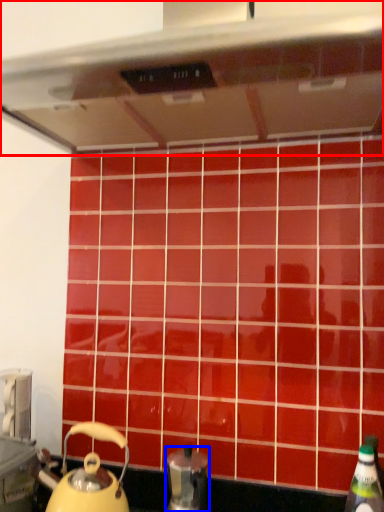
Question: Which point is further to the camera, exhaust hood (highlighted by a red box) or kitchen appliance (highlighted by a blue box)?

Choices:
 (A) exhaust hood
 (B) kitchen appliance

Answer: (B)